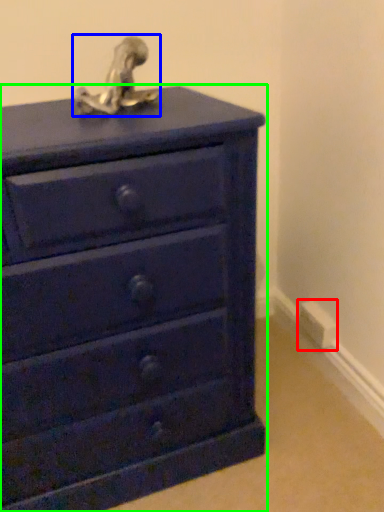
Question: Which object is positioned farthest from electric outlet (highlighted by a red box)? Select from sculpture (highlighted by a blue box) and chest of drawers (highlighted by a green box).

Choices:
 (A) sculpture
 (B) chest of drawers

Answer: (A)